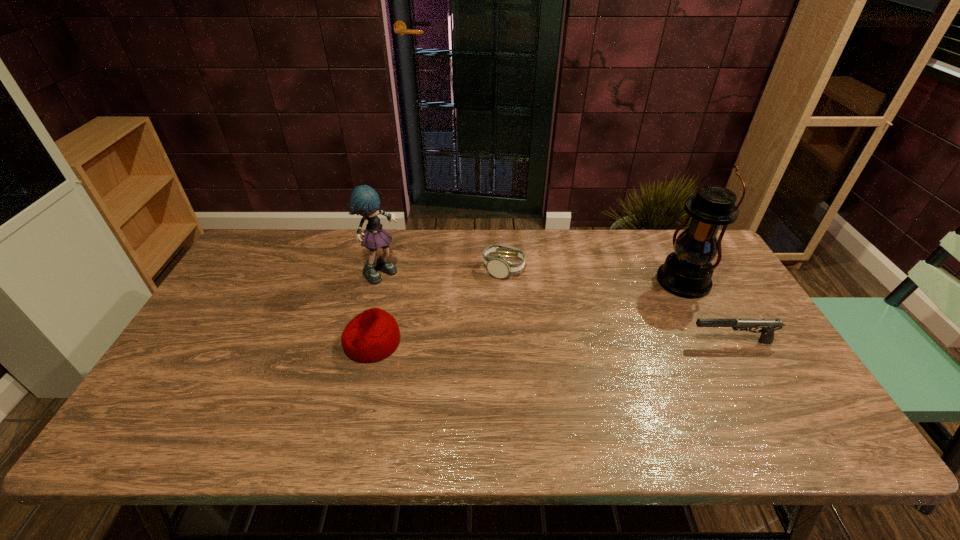
Where is `beanbag`? The width and height of the screenshot is (960, 540). beanbag is located at coordinates (374, 334).

The image size is (960, 540). I want to click on gun, so click(x=768, y=326).

The height and width of the screenshot is (540, 960). Identify the location of rag doll. (364, 201).

The image size is (960, 540). I want to click on watch, so click(499, 267).

What are the coordinates of `the tallest object` in the screenshot? It's located at (687, 272).

At what (x,y) coordinates should I click in order to perform the action: click on vacant area located on the seat area of the beanbag. Please return your answer as a coordinate pair (x, y). Image resolution: width=960 pixels, height=540 pixels. Looking at the image, I should click on (280, 342).

I want to click on vacant space located on the seat area of the beanbag, so click(x=235, y=342).

The height and width of the screenshot is (540, 960). In order to click on vacant region located 0.260m on the seat area of the beanbag in this screenshot , I will do `click(247, 342)`.

Find the location of a particular element. The image size is (960, 540). vacant space located at the muzzle end of the gun is located at coordinates (585, 342).

The image size is (960, 540). Find the location of `vacant region located at the muzzle end of the gun`. vacant region located at the muzzle end of the gun is located at coordinates (612, 342).